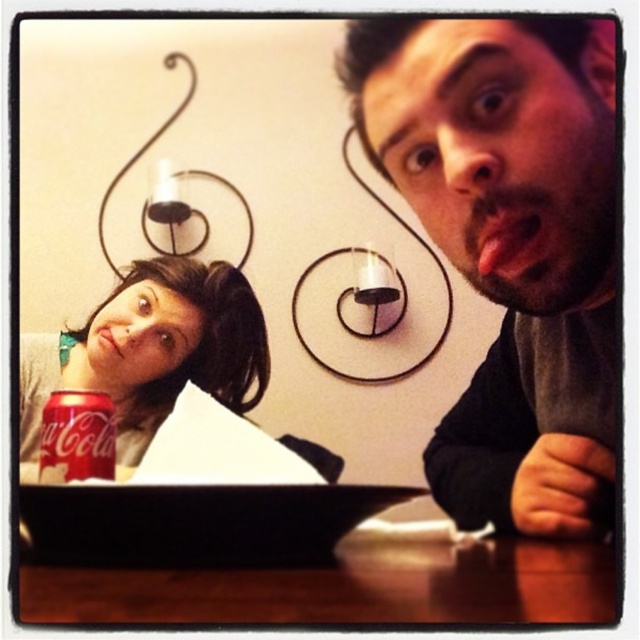
Question: Which point is farther to the camera?

Choices:
 (A) bearded man at center
 (B) matte red can at lower left
 (C) matte skin mouth at lower left
 (D) red matte coca-cola can at lower left

Answer: (C)

Question: Can you confirm if wooden table at lower center is positioned to the right of smooth pink tongue at center?

Choices:
 (A) yes
 (B) no

Answer: (B)

Question: Which object is closer to the camera taking this photo?

Choices:
 (A) matte skin mouth at lower left
 (B) matte red can at lower left
 (C) smooth pink tongue at center

Answer: (C)

Question: Can you confirm if smooth pink tongue at center is positioned to the right of red matte coca-cola can at lower left?

Choices:
 (A) yes
 (B) no

Answer: (A)

Question: Which of these objects is positioned closest to the bearded man at center?

Choices:
 (A) wooden table at lower center
 (B) smooth pink tongue at center
 (C) red matte coca-cola can at lower left

Answer: (B)

Question: Can you confirm if bearded man at center is bigger than matte red can at lower left?

Choices:
 (A) no
 (B) yes

Answer: (B)